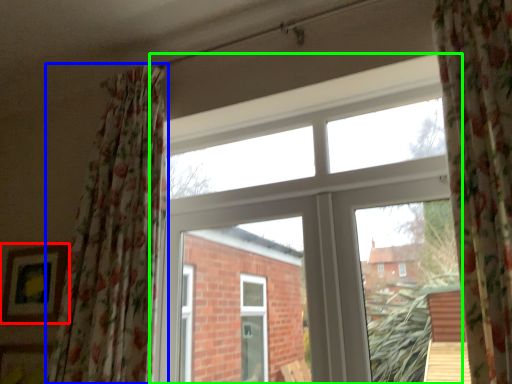
Question: Estimate the real-world distances between objects in this image. Which object is farther from picture frame (highlighted by a red box), curtain (highlighted by a blue box) or window (highlighted by a green box)?

Choices:
 (A) curtain
 (B) window

Answer: (B)